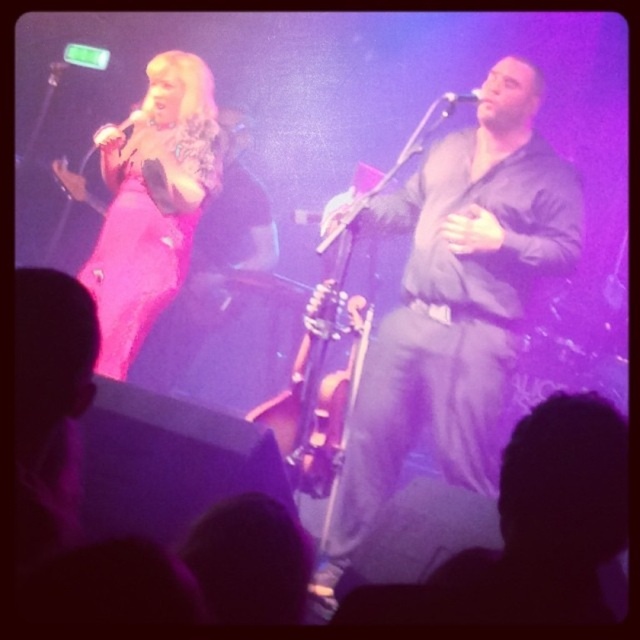
Question: Considering the relative positions of metallic silver microphone at upper left and metallic silver microphone at upper center in the image provided, where is metallic silver microphone at upper left located with respect to metallic silver microphone at upper center?

Choices:
 (A) left
 (B) right

Answer: (A)

Question: Which of the following is the closest to the observer?

Choices:
 (A) (122, 125)
 (B) (113, 337)
 (C) (440, 259)
 (D) (474, 88)

Answer: (C)

Question: In this image, where is matte black shirt at center located relative to metallic silver microphone at upper left?

Choices:
 (A) left
 (B) right

Answer: (B)

Question: Which point is farther to the camera?

Choices:
 (A) metallic silver microphone at upper left
 (B) shiny pink dress at upper left

Answer: (A)

Question: Is matte black shirt at center smaller than metallic silver microphone at upper center?

Choices:
 (A) no
 (B) yes

Answer: (A)

Question: Which object is positioned farthest from the shiny pink dress at upper left?

Choices:
 (A) metallic silver microphone at upper center
 (B) metallic silver microphone at upper left
 (C) matte black shirt at center

Answer: (A)